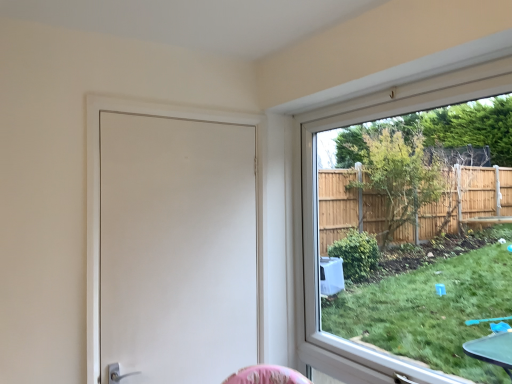
Question: From the image's perspective, is clear glass window at upper right located above or below white matte door at left?

Choices:
 (A) below
 (B) above

Answer: (B)

Question: Visually, is clear glass window at upper right positioned to the left or to the right of white matte door at left?

Choices:
 (A) right
 (B) left

Answer: (A)

Question: Choose the correct answer: Is clear glass window at upper right inside white matte door at left or outside it?

Choices:
 (A) inside
 (B) outside

Answer: (B)

Question: Is white matte door at left wider or thinner than clear glass window at upper right?

Choices:
 (A) wide
 (B) thin

Answer: (B)

Question: In terms of size, does white matte door at left appear bigger or smaller than clear glass window at upper right?

Choices:
 (A) big
 (B) small

Answer: (B)

Question: Is point (95, 208) positioned closer to the camera than point (327, 117)?

Choices:
 (A) farther
 (B) closer

Answer: (B)

Question: Is white matte door at left spatially inside clear glass window at upper right, or outside of it?

Choices:
 (A) outside
 (B) inside

Answer: (A)